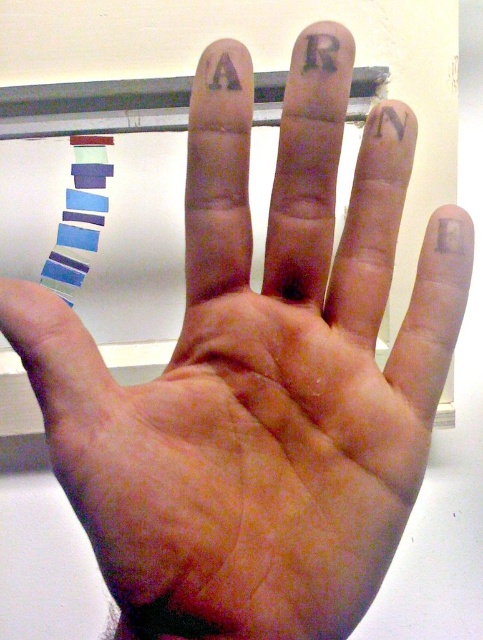
Is black tattoo at upper center thinner than black matte letter at upper right?

Yes.

Can you confirm if black tattoo at upper center is shorter than black matte letter at upper right?

Correct, black tattoo at upper center is not as tall as black matte letter at upper right.

Between point (336, 58) and point (402, 122), which one is positioned in front?

Point (336, 58)

Image resolution: width=483 pixels, height=640 pixels. Find the location of `black tattoo at upper center`. black tattoo at upper center is located at coordinates (321, 52).

Is black matte letter at upper right smaller than matte purple letter a at upper center?

Incorrect, black matte letter at upper right is not smaller in size than matte purple letter a at upper center.

From the picture: Is black matte letter at upper right above matte purple letter a at upper center?

Incorrect, black matte letter at upper right is not positioned above matte purple letter a at upper center.

Who is more distant from viewer, (x=407, y=113) or (x=210, y=90)?

The point (x=407, y=113) is more distant.

Where is `black matte letter at upper right`? The height and width of the screenshot is (640, 483). black matte letter at upper right is located at coordinates (389, 118).

Who is more distant from viewer, (322, 68) or (217, 83)?

The point (217, 83) is behind.

Does black tattoo at upper center have a smaller size compared to matte purple letter a at upper center?

Correct, black tattoo at upper center occupies less space than matte purple letter a at upper center.

Between point (316, 38) and point (219, 61), which one is positioned behind?

The point (219, 61) is behind.

At what (x,y) coordinates should I click in order to perform the action: click on black tattoo at upper center. Please return your answer as a coordinate pair (x, y). Looking at the image, I should click on (321, 52).